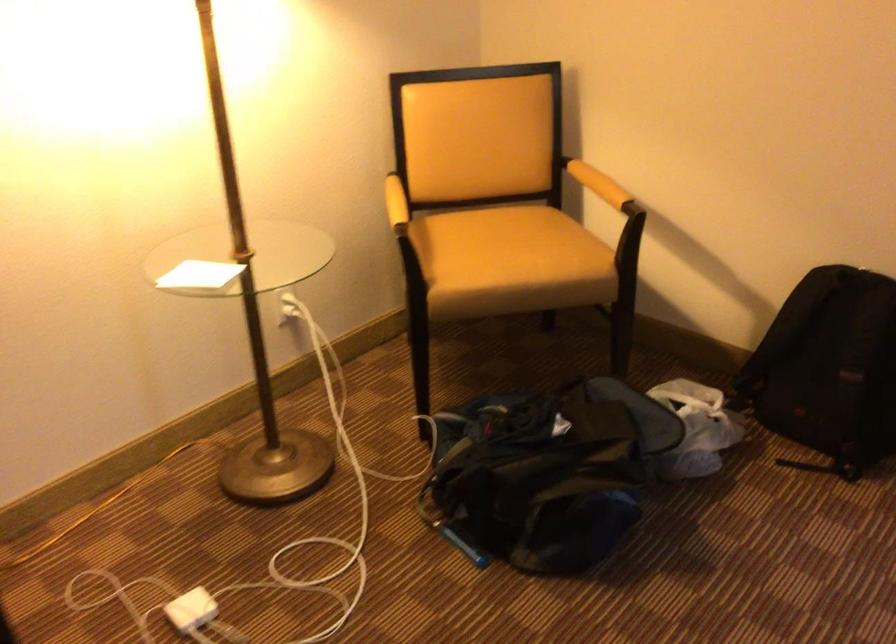
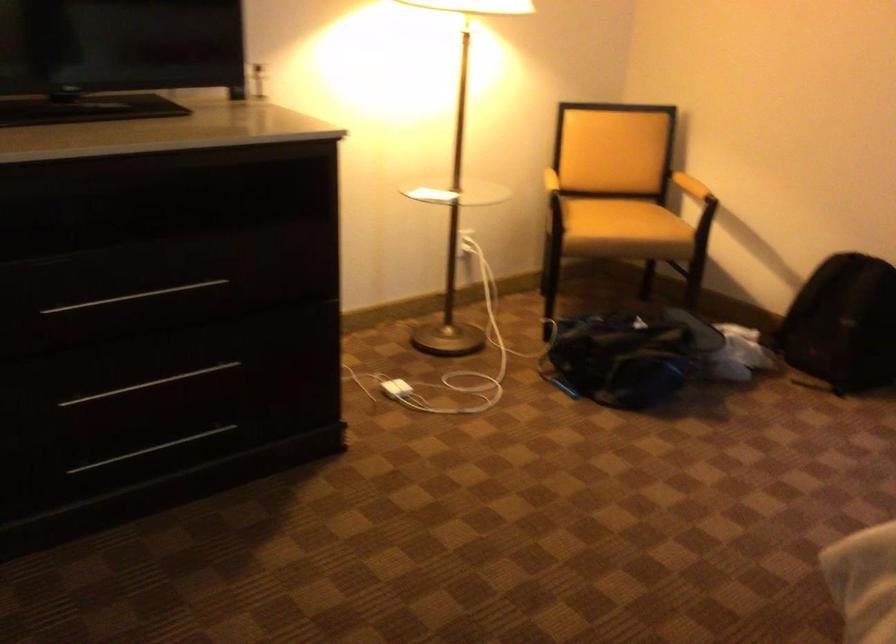
Question: In a continuous first-person perspective shot, in which direction is the camera moving?

Choices:
 (A) Left
 (B) Right
 (C) Forward
 (D) Backward

Answer: (D)